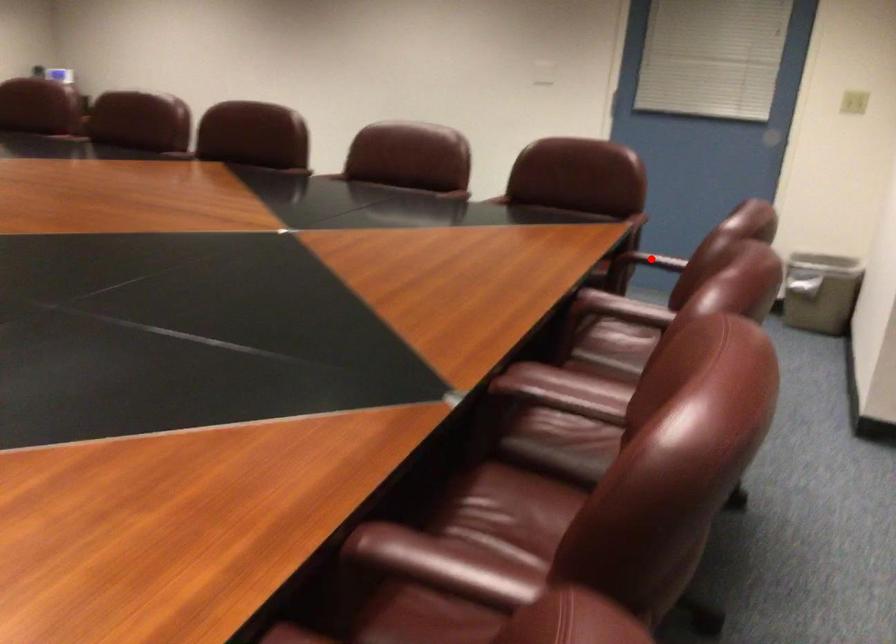
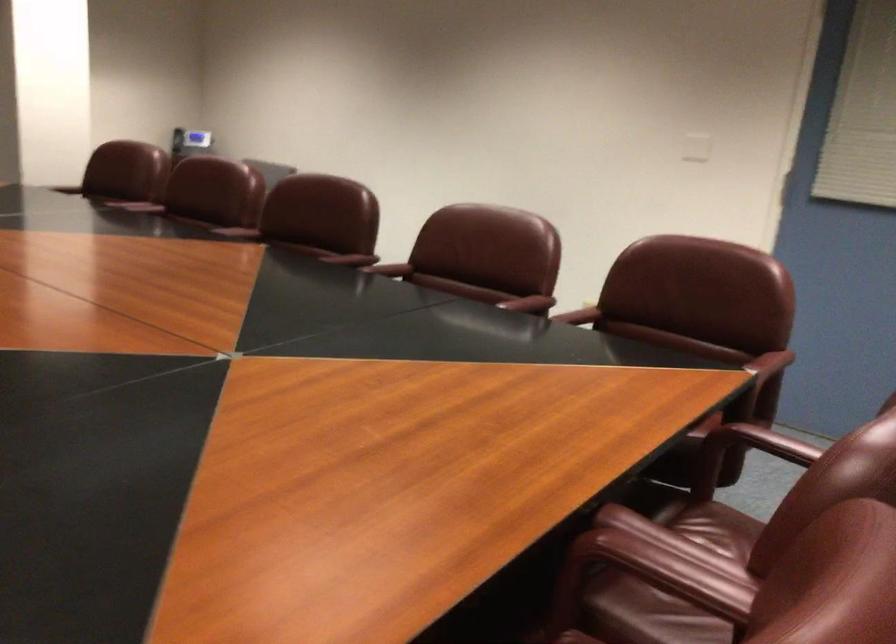
Question: A red point is marked in image1. In image2, is the corresponding 3D point closer to the camera or farther? Reply with the corresponding letter.

Choices:
 (A) The corresponding 3D point is closer.
 (B) The corresponding 3D point is farther.

Answer: (A)